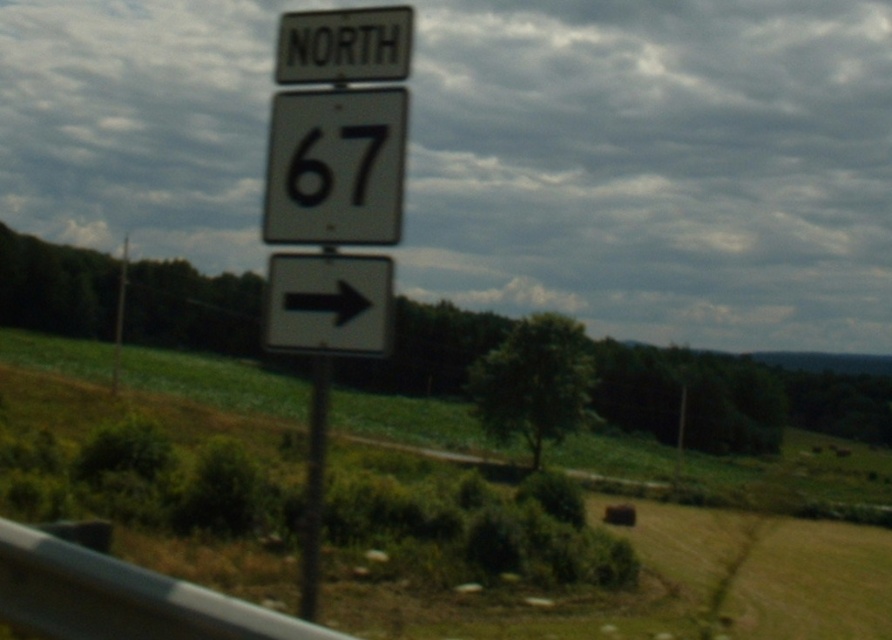
Question: Is white glossy sign at center positioned at the back of black matte number at center?

Choices:
 (A) no
 (B) yes

Answer: (A)

Question: Which point appears farthest from the camera in this image?

Choices:
 (A) (321, 374)
 (B) (365, 132)

Answer: (B)

Question: Estimate the real-world distances between objects in this image. Which object is closer to the black matte number at center?

Choices:
 (A) white glossy sign at center
 (B) metallic pole at center

Answer: (A)

Question: Estimate the real-world distances between objects in this image. Which object is farther from the metallic pole at center?

Choices:
 (A) black matte number at center
 (B) white glossy sign at center

Answer: (B)

Question: Does metallic pole at center lie in front of black matte number at center?

Choices:
 (A) no
 (B) yes

Answer: (B)

Question: Is white glossy sign at center to the left of black matte number at center from the viewer's perspective?

Choices:
 (A) no
 (B) yes

Answer: (B)